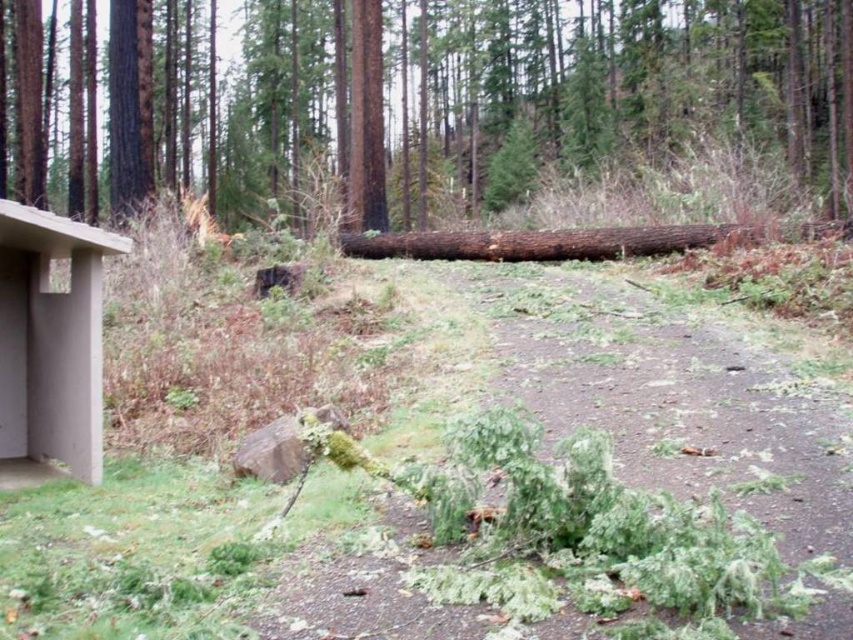
Based on the photo, you are a park maintenance worker who needs to clear the path. You see green leafy debris at center. How far apart are they?

The green leafy debris at center are 7.69 feet apart.

You are a hiker trying to cross the path in the forest. You see the green mossy log at center and the green leafy debris at center. Which object is closer to you as you approach the path?

The green mossy log at center is closer to you than the green leafy debris at center because it is further to the viewer.

You are a hiker who needs to cross the path in the forest. You see a green mossy log at center and a green leafy debris at center. Which one is larger and should you avoid stepping on to prevent slipping?

The green mossy log at center is bigger than green leafy debris at center. You should avoid stepping on the green mossy log at center because it is larger and more likely to be slippery due to its mossy surface.